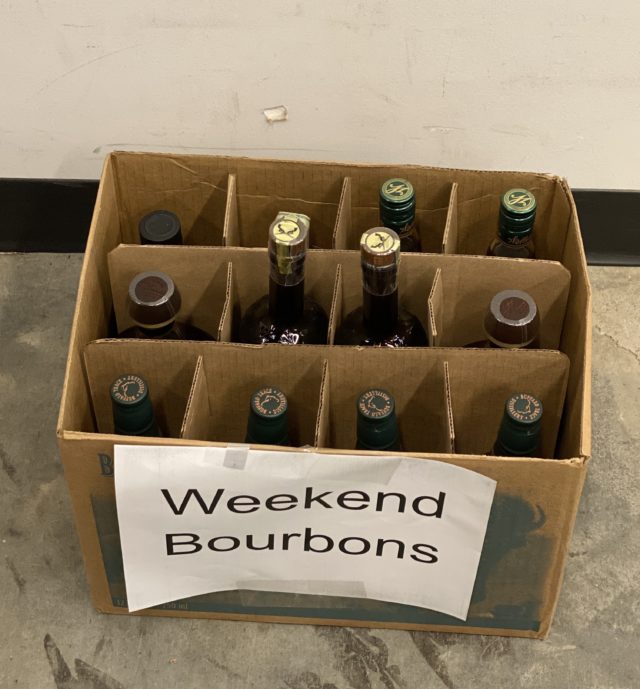
I want to click on clear tape, so (235, 464), (356, 469), (283, 604).